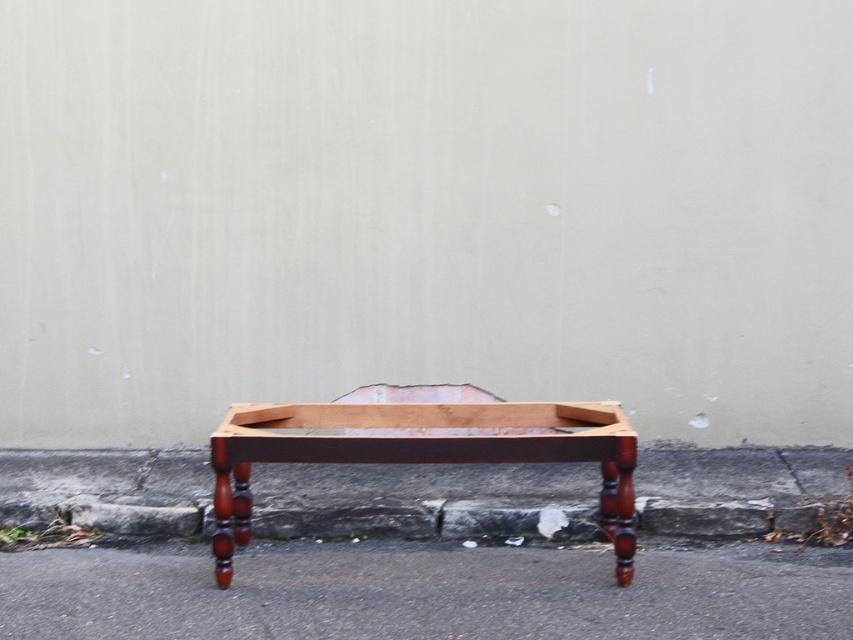
You are a delivery person trying to park your bike. You see the smooth asphalt at lower center and the gray concrete curb at lower center in the image. Which surface can you safely park your bike on?

The smooth asphalt at lower center is wider than the gray concrete curb at lower center, so you can safely park your bike on the smooth asphalt at lower center.

You are standing at a point 15 feet away from the wooden table or stand. Can you determine if you are closer to or farther from the wooden table or stand compared to the point labeled as point [187,582]?

The distance between point [187,582] and the camera is 15.93 feet. Since you are standing 15 feet away from the wooden table or stand, you are closer to the wooden table or stand than point [187,582].

You are standing in front of the mahogany wood table at center. Looking down, you notice the smooth asphalt at lower center. In which direction relative to the table is the asphalt located?

The smooth asphalt at lower center is located to the right of the mahogany wood table at center.